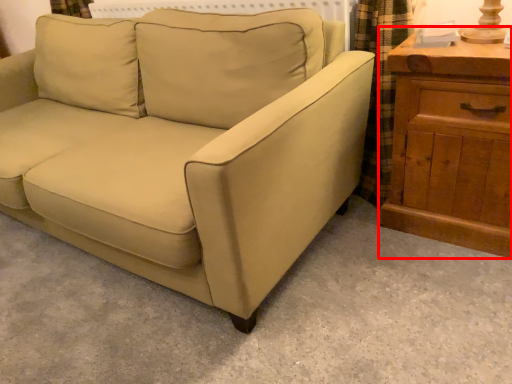
Question: Considering the relative positions of chest of drawers (annotated by the red box) and studio couch in the image provided, where is chest of drawers (annotated by the red box) located with respect to the staircase?

Choices:
 (A) left
 (B) right

Answer: (B)